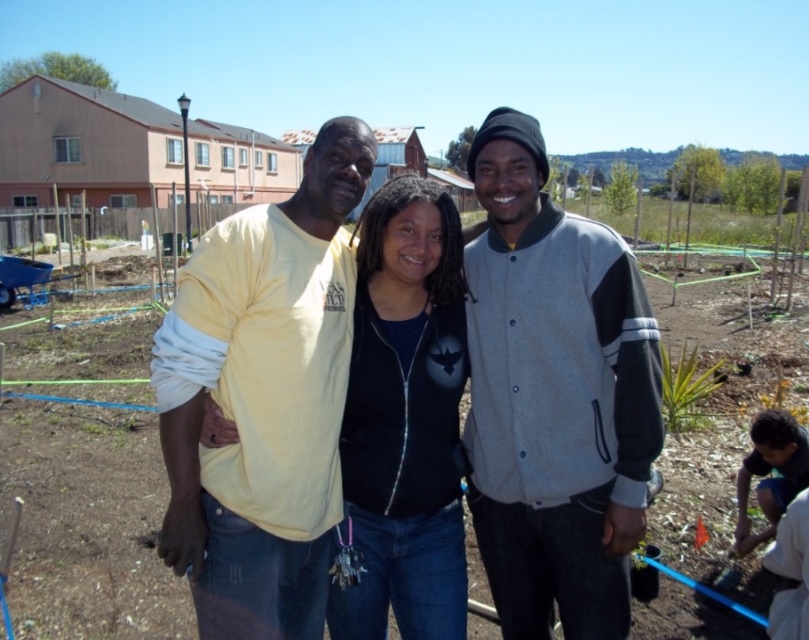
Between yellow cotton shirt at center and black matte jacket at center, which one has less height?

black matte jacket at center

Is yellow cotton shirt at center to the right of black matte jacket at center from the viewer's perspective?

No, yellow cotton shirt at center is not to the right of black matte jacket at center.

Who is more forward, (x=236, y=467) or (x=361, y=600)?

Point (x=236, y=467)

What are the coordinates of `yellow cotton shirt at center` in the screenshot? It's located at pyautogui.click(x=261, y=400).

Based on the photo, can you confirm if gray woolen jacket at center is smaller than yellow cotton shirt at center?

Yes.

Who is more forward, (x=621, y=616) or (x=314, y=362)?

Point (x=314, y=362) is in front.

What do you see at coordinates (553, 396) in the screenshot?
I see `gray woolen jacket at center` at bounding box center [553, 396].

You are a GUI agent. You are given a task and a screenshot of the screen. Output one action in this format:
    pyautogui.click(x=<x>, y=<y>)
    Task: Click on the gray woolen jacket at center
    
    Given the screenshot: What is the action you would take?
    pyautogui.click(x=553, y=396)

Looking at this image, between matte yellow shirt at center and black matte jacket at center, which one is positioned higher?

black matte jacket at center is above.

Is matte yellow shirt at center to the left of black matte jacket at center from the viewer's perspective?

Indeed, matte yellow shirt at center is positioned on the left side of black matte jacket at center.

Is point (333, 160) positioned before point (462, 330)?

Yes, it is.

Image resolution: width=809 pixels, height=640 pixels. I want to click on matte yellow shirt at center, so click(401, 410).